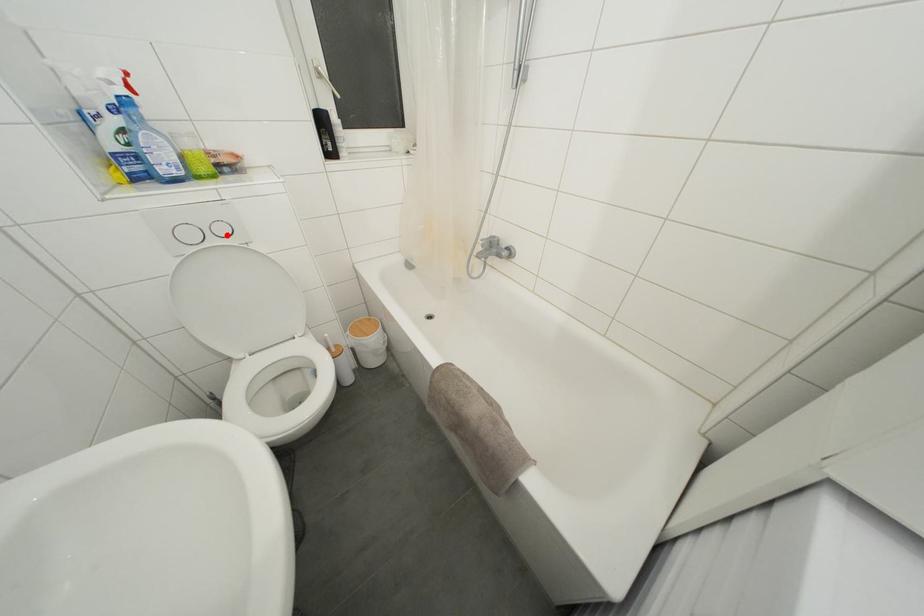
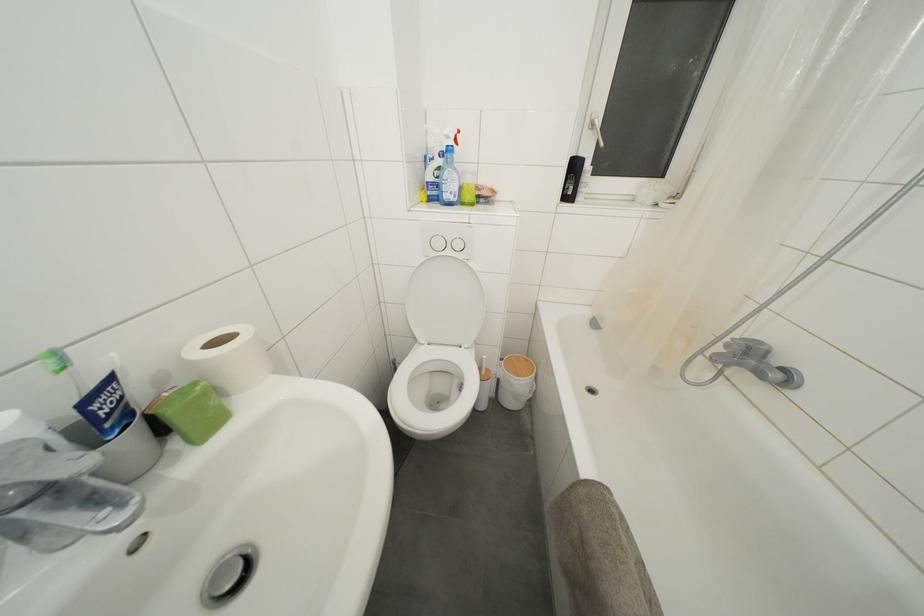
Where in the second image is the point corresponding to the highlighted location from the first image?

(463, 251)